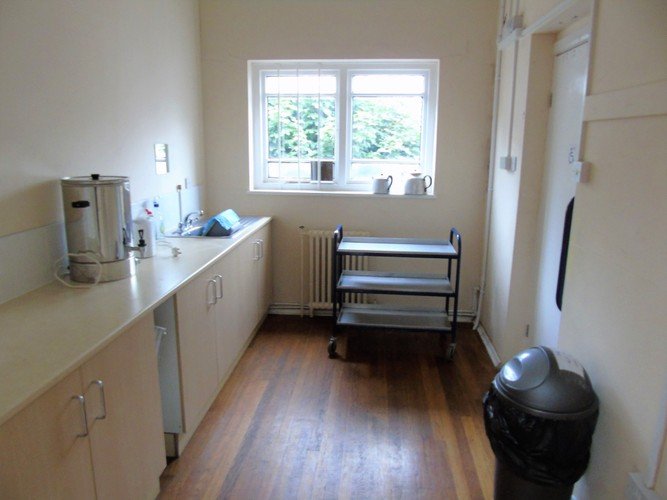
Where is `door`? This screenshot has height=500, width=667. door is located at coordinates (569, 77), (548, 276).